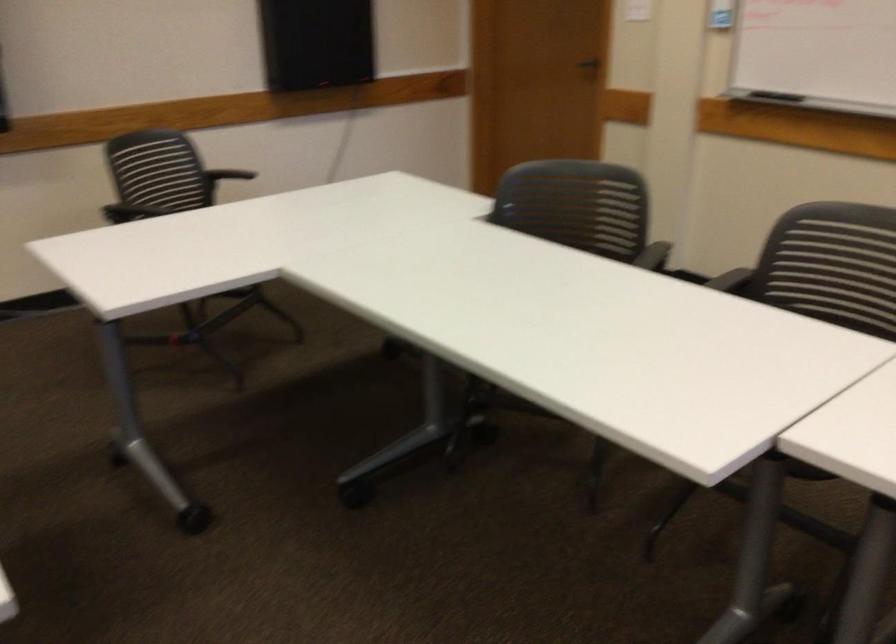
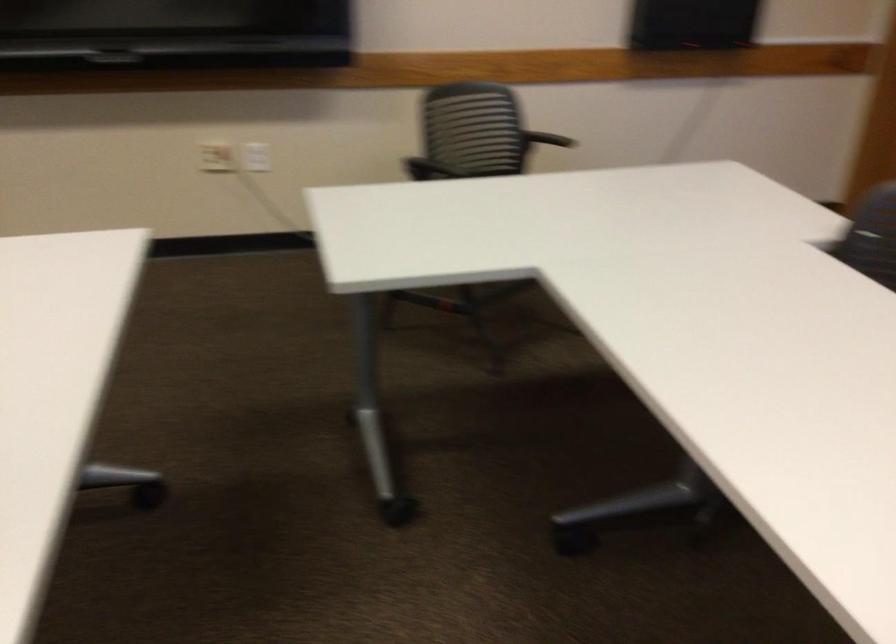
The point at (143, 213) is marked in the first image. Where is the corresponding point in the second image?

(425, 169)